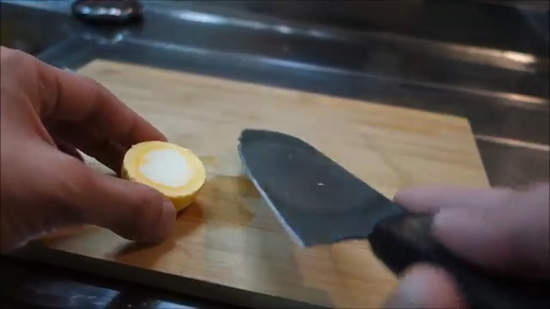
Where is `knife handle`? Image resolution: width=550 pixels, height=309 pixels. knife handle is located at coordinates (419, 245).